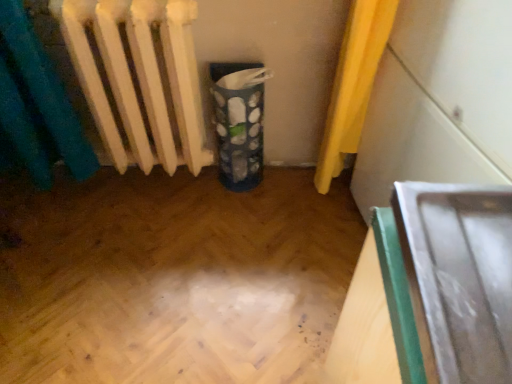
You are a GUI agent. You are given a task and a screenshot of the screen. Output one action in this format:
    pyautogui.click(x=<x>, y=<y>)
    Task: Click on the vacant area to the right of blue fabric recycling bin at center
    The width and height of the screenshot is (512, 384).
    Given the screenshot: What is the action you would take?
    pyautogui.click(x=290, y=189)